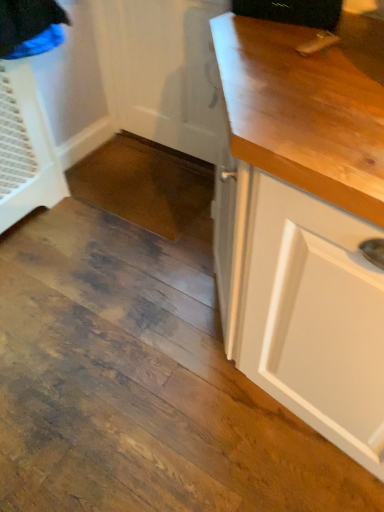
This screenshot has width=384, height=512. In order to click on empty space that is to the right of white plastic laundry basket at left in this screenshot , I will do point(100,211).